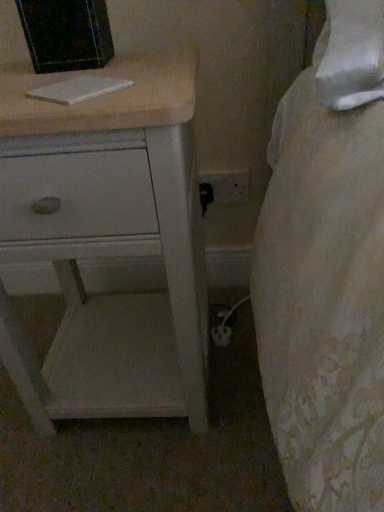
Describe the element at coordinates (109, 241) in the screenshot. The width and height of the screenshot is (384, 512). I see `white painted wood chest of drawers at left` at that location.

At what (x,y) coordinates should I click in order to perform the action: click on white painted wood chest of drawers at left. Please return your answer as a coordinate pair (x, y). The image size is (384, 512). Looking at the image, I should click on tap(109, 241).

Describe the element at coordinates (78, 89) in the screenshot. I see `white matte book at upper left` at that location.

Where is `white matte book at upper left`? white matte book at upper left is located at coordinates (78, 89).

At what (x,y) coordinates should I click in order to perform the action: click on white painted wood chest of drawers at left. Please return your answer as a coordinate pair (x, y). This screenshot has height=512, width=384. Looking at the image, I should click on (109, 241).

Looking at this image, considering the positions of objects white matte book at upper left and white painted wood chest of drawers at left in the image provided, who is more to the right, white matte book at upper left or white painted wood chest of drawers at left?

From the viewer's perspective, white matte book at upper left appears more on the right side.

Does white matte book at upper left come in front of white painted wood chest of drawers at left?

No, it is behind white painted wood chest of drawers at left.

Which is nearer, [92,97] or [66,296]?

Clearly, point [92,97] is closer to the camera than point [66,296].

From the picture: From the image's perspective, is white matte book at upper left above or below white painted wood chest of drawers at left?

white matte book at upper left is above white painted wood chest of drawers at left.

From a real-world perspective, which is physically above, white matte book at upper left or white painted wood chest of drawers at left?

From a 3D spatial view, white matte book at upper left is above.

Between white matte book at upper left and white painted wood chest of drawers at left, which one has smaller width?

Thinner between the two is white matte book at upper left.

Does white matte book at upper left have a lesser height compared to white painted wood chest of drawers at left?

Correct, white matte book at upper left is not as tall as white painted wood chest of drawers at left.

Considering the relative sizes of white matte book at upper left and white painted wood chest of drawers at left in the image provided, is white matte book at upper left bigger than white painted wood chest of drawers at left?

No, white matte book at upper left is not bigger than white painted wood chest of drawers at left.

Is white matte book at upper left situated inside white painted wood chest of drawers at left or outside?

white matte book at upper left can be found inside white painted wood chest of drawers at left.

Is white matte book at upper left next to white painted wood chest of drawers at left and touching it?

white matte book at upper left and white painted wood chest of drawers at left are not in contact.

Is white matte book at upper left aimed at white painted wood chest of drawers at left?

Yes, white matte book at upper left is aimed at white painted wood chest of drawers at left.

I want to click on book located on the right of white painted wood chest of drawers at left, so click(78, 89).

Visually, is white painted wood chest of drawers at left positioned to the left or to the right of white matte book at upper left?

In the image, white painted wood chest of drawers at left appears on the left side of white matte book at upper left.

Which is in front, white painted wood chest of drawers at left or white matte book at upper left?

white painted wood chest of drawers at left.

Which is less distant, (25, 120) or (51, 86)?

The point (25, 120) is closer to the camera.

From the image's perspective, is white painted wood chest of drawers at left under white matte book at upper left?

Yes, from the image's perspective, white painted wood chest of drawers at left is beneath white matte book at upper left.

From a real-world perspective, between white painted wood chest of drawers at left and white matte book at upper left, who is vertically lower?

From a 3D spatial view, white painted wood chest of drawers at left is below.

Considering the relative sizes of white painted wood chest of drawers at left and white matte book at upper left in the image provided, is white painted wood chest of drawers at left wider than white matte book at upper left?

Indeed, white painted wood chest of drawers at left has a greater width compared to white matte book at upper left.

Who is taller, white painted wood chest of drawers at left or white matte book at upper left?

Standing taller between the two is white painted wood chest of drawers at left.

Who is bigger, white painted wood chest of drawers at left or white matte book at upper left?

white painted wood chest of drawers at left.

Is white painted wood chest of drawers at left positioned beyond the bounds of white matte book at upper left?

Indeed, white painted wood chest of drawers at left is completely outside white matte book at upper left.

Is the surface of white painted wood chest of drawers at left in direct contact with white matte book at upper left?

No, white painted wood chest of drawers at left is not beside white matte book at upper left.

From the picture: Is white painted wood chest of drawers at left looking in the opposite direction of white matte book at upper left?

No, white painted wood chest of drawers at left's orientation is not away from white matte book at upper left.

What's the angular difference between white painted wood chest of drawers at left and white matte book at upper left's facing directions?

48.7 degrees.

I want to click on book above the white painted wood chest of drawers at left (from a real-world perspective), so click(78, 89).

Identify the location of the chest of drawers below the white matte book at upper left (from a real-world perspective). (109, 241).

The height and width of the screenshot is (512, 384). Find the location of `chest of drawers on the left of white matte book at upper left`. chest of drawers on the left of white matte book at upper left is located at coordinates (109, 241).